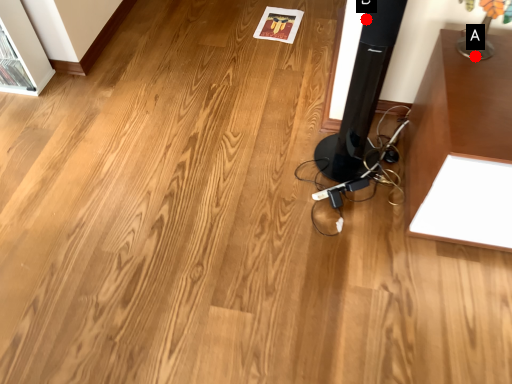
Question: Two points are circled on the image, labeled by A and B beside each circle. Which point is further to the camera?

Choices:
 (A) A is further
 (B) B is further

Answer: (A)